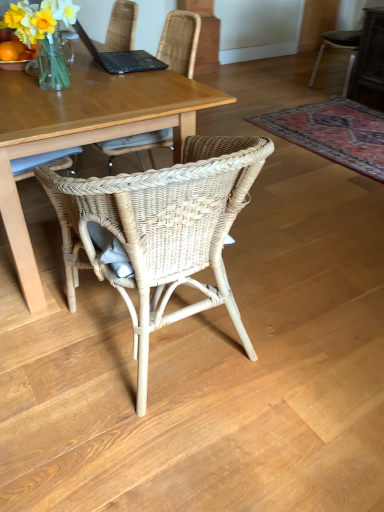
At what (x,y) coordinates should I click in order to perform the action: click on empty space that is to the right of woven rattan chair at center, the 2th chair in the right-to-left sequence. Please return your answer as a coordinate pair (x, y). This screenshot has width=384, height=512. Looking at the image, I should click on coord(309,332).